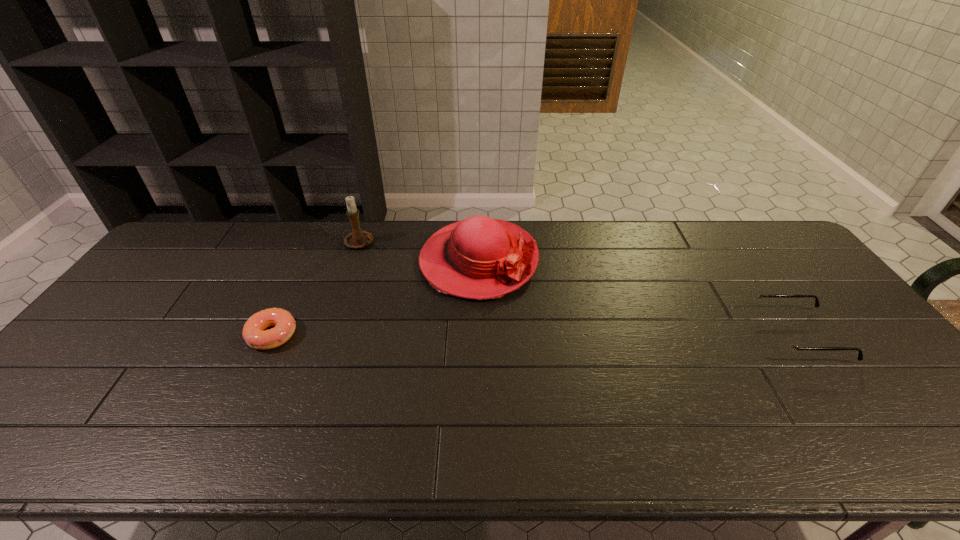
The image size is (960, 540). I want to click on object that is at the right edge, so click(x=783, y=342).

Identify the location of vacant space at the far edge of the desktop. The height and width of the screenshot is (540, 960). (734, 249).

Where is `vacant region at the near edge of the desktop`? This screenshot has width=960, height=540. vacant region at the near edge of the desktop is located at coordinates (435, 390).

Image resolution: width=960 pixels, height=540 pixels. In the image, there is a desktop. Find the location of `free space at the right edge`. free space at the right edge is located at coordinates (852, 337).

You are a GUI agent. You are given a task and a screenshot of the screen. Output one action in this format:
    pyautogui.click(x=<x>, y=<y>)
    Task: Click on the vacant space at the far right corner of the desktop
    This screenshot has height=540, width=960.
    Given the screenshot: What is the action you would take?
    tap(776, 231)

The image size is (960, 540). In the image, there is a desktop. Find the location of `vacant space at the near right corner`. vacant space at the near right corner is located at coordinates (879, 405).

This screenshot has width=960, height=540. I want to click on free area in between the leftmost object and the second object from left to right, so click(x=316, y=289).

Where is `blank region between the shortest object and the rightmost object`? Image resolution: width=960 pixels, height=540 pixels. blank region between the shortest object and the rightmost object is located at coordinates (536, 335).

This screenshot has height=540, width=960. What are the coordinates of `empty location between the second object from left to right and the hat` in the screenshot? It's located at (420, 252).

What are the coordinates of `free space between the doughnut and the third shortest object` in the screenshot? It's located at (375, 298).